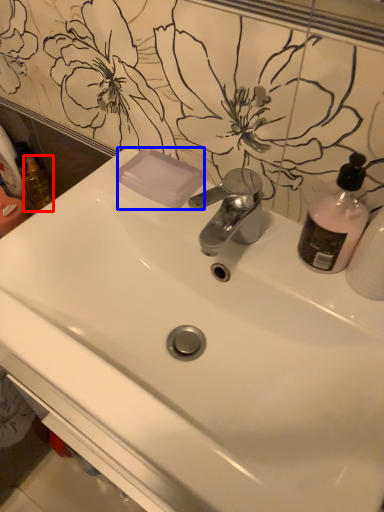
Question: Among these objects, which one is farthest to the camera, mouthwash (highlighted by a red box) or soap (highlighted by a blue box)?

Choices:
 (A) mouthwash
 (B) soap

Answer: (A)